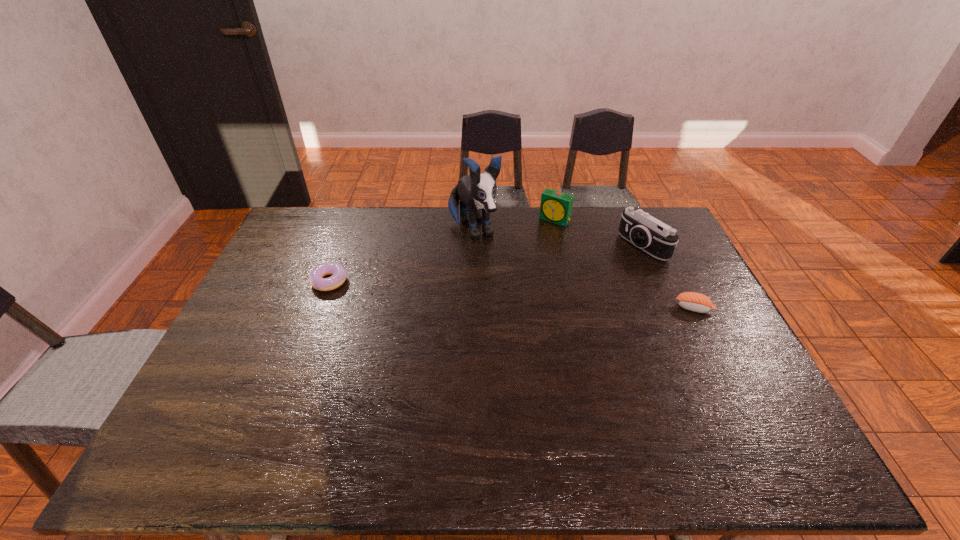
The height and width of the screenshot is (540, 960). I want to click on vacant spot on the desktop that is between the shortest object and the sushi and is positioned on the front-facing side of the tallest object, so click(511, 294).

The height and width of the screenshot is (540, 960). I want to click on vacant space on the desktop that is between the doughnut and the sushi and is positioned on the front lens of the camera, so click(x=549, y=298).

Locate an element on the screen. This screenshot has width=960, height=540. free spot on the desktop that is between the shortest object and the sushi and is positioned on the front-facing side of the third tallest object is located at coordinates click(494, 293).